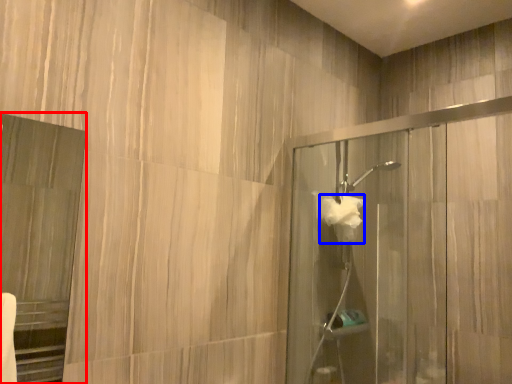
Question: Which object is closer to the camera taking this photo, screen door (highlighted by a red box) or hand towel (highlighted by a blue box)?

Choices:
 (A) screen door
 (B) hand towel

Answer: (A)